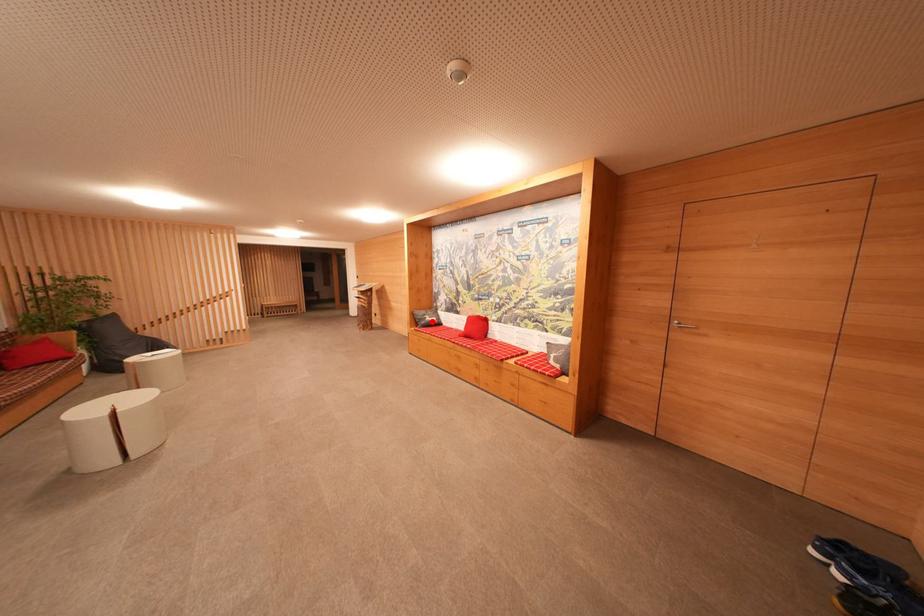
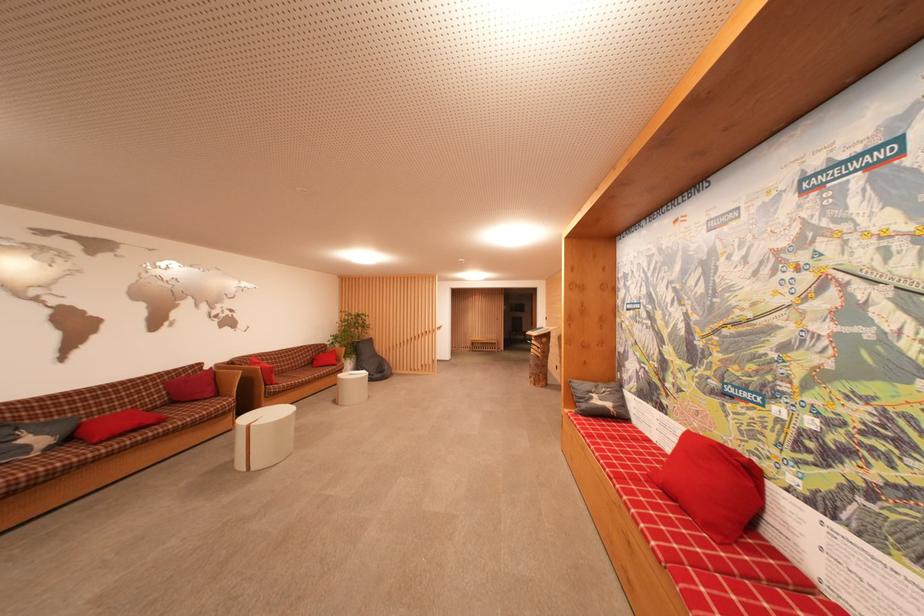
Where in the second image is the point corresponding to the highlighted location from the first image?

(601, 405)